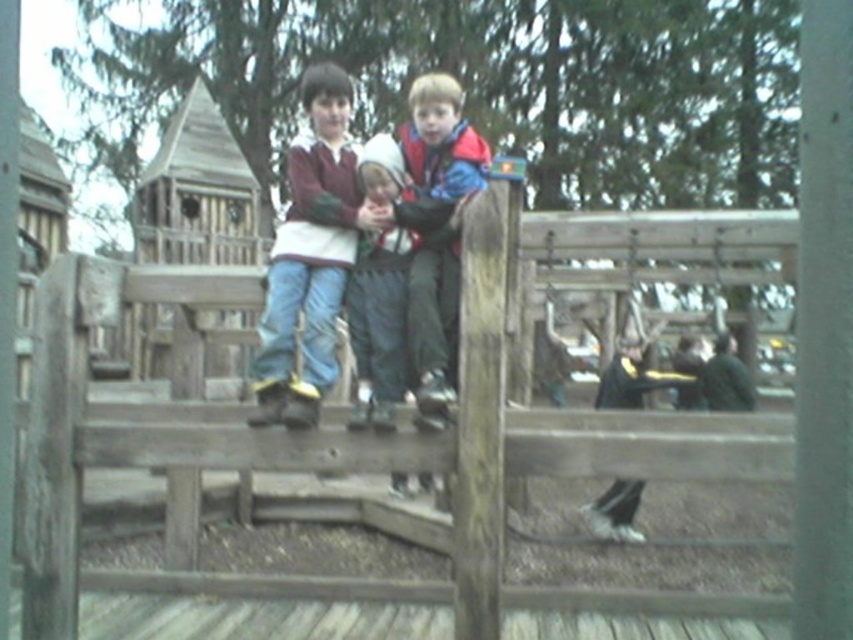
Can you confirm if wooden at center is bigger than smooth gray pole at center?

Yes.

Which is above, wooden at center or smooth gray pole at center?

smooth gray pole at center

Between point (109, 444) and point (793, 531), which one is positioned behind?

The point (109, 444) is more distant.

The image size is (853, 640). In order to click on wooden at center in this screenshot , I will do `click(157, 445)`.

Which is behind, point (817, 620) or point (422, 241)?

The point (422, 241) is more distant.

Which is above, smooth gray pole at center or matte blue jacket at center?

matte blue jacket at center is above.

Is point (801, 16) farther from camera compared to point (479, 134)?

No.

The height and width of the screenshot is (640, 853). What are the coordinates of `smooth gray pole at center` in the screenshot? It's located at (824, 326).

Who is higher up, smooth gray pole at center or matte maroon sweater at center?

matte maroon sweater at center is above.

Is smooth gray pole at center above matte maroon sweater at center?

Actually, smooth gray pole at center is below matte maroon sweater at center.

Locate an element on the screen. This screenshot has height=640, width=853. smooth gray pole at center is located at coordinates (824, 326).